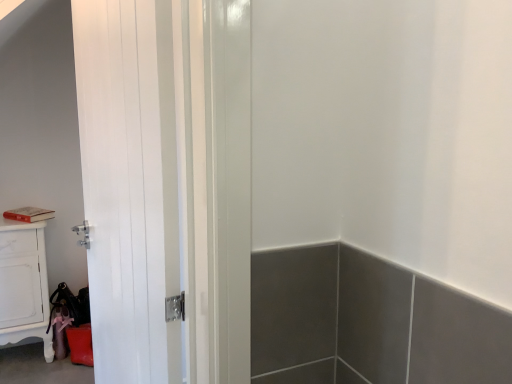
Measure the distance between point (209, 151) and camera.

Point (209, 151) and camera are 29.13 inches apart from each other.

This screenshot has width=512, height=384. Describe the element at coordinates (166, 183) in the screenshot. I see `white glossy door at center` at that location.

Where is `white glossy door at center`? This screenshot has width=512, height=384. white glossy door at center is located at coordinates (166, 183).

Where is `white glossy cabinet at lower left`? This screenshot has width=512, height=384. white glossy cabinet at lower left is located at coordinates (24, 284).

Measure the distance between point (11, 298) and camera.

Point (11, 298) is 7.76 feet from camera.

The width and height of the screenshot is (512, 384). Describe the element at coordinates (24, 284) in the screenshot. I see `white glossy cabinet at lower left` at that location.

In order to click on white glossy door at center in this screenshot , I will do `click(166, 183)`.

Is white glossy door at center at the left side of white glossy cabinet at lower left?

No, white glossy door at center is not to the left of white glossy cabinet at lower left.

Is the position of white glossy door at center more distant than that of white glossy cabinet at lower left?

No.

Which is closer, (106,164) or (21,328)?

Point (106,164) is positioned closer to the camera compared to point (21,328).

Looking at this image, from the image's perspective, relative to white glossy cabinet at lower left, is white glossy door at center above or below?

Clearly, from the image's perspective, white glossy door at center is above white glossy cabinet at lower left.

From a real-world perspective, is white glossy door at center on top of white glossy cabinet at lower left?

Correct, in the physical world, white glossy door at center is higher than white glossy cabinet at lower left.

Considering the sizes of objects white glossy door at center and white glossy cabinet at lower left in the image provided, who is thinner, white glossy door at center or white glossy cabinet at lower left?

Thinner between the two is white glossy door at center.

Between white glossy door at center and white glossy cabinet at lower left, which one has less height?

With less height is white glossy cabinet at lower left.

Who is bigger, white glossy door at center or white glossy cabinet at lower left?

white glossy door at center.

Consider the image. Is white glossy door at center inside or outside of white glossy cabinet at lower left?

white glossy door at center is spatially situated outside white glossy cabinet at lower left.

Would you say white glossy door at center is a long distance from white glossy cabinet at lower left?

That's right, there is a large distance between white glossy door at center and white glossy cabinet at lower left.

Could you tell me if white glossy door at center is turned towards white glossy cabinet at lower left?

No, white glossy door at center is not facing towards white glossy cabinet at lower left.

The width and height of the screenshot is (512, 384). I want to click on door on the right of white glossy cabinet at lower left, so click(166, 183).

Is white glossy cabinet at lower left at the left side of white glossy door at center?

Yes.

Which is behind, white glossy cabinet at lower left or white glossy door at center?

white glossy cabinet at lower left is further from the camera.

Is point (37, 317) less distant than point (138, 75)?

No, it is not.

From the image's perspective, is white glossy cabinet at lower left positioned above or below white glossy door at center?

Clearly, from the image's perspective, white glossy cabinet at lower left is below white glossy door at center.

Consider the image. From a real-world perspective, is white glossy cabinet at lower left positioned under white glossy door at center based on gravity?

Yes, from a real-world perspective, white glossy cabinet at lower left is beneath white glossy door at center.

Between white glossy cabinet at lower left and white glossy door at center, which one has larger width?

white glossy cabinet at lower left is wider.

Can you confirm if white glossy cabinet at lower left is shorter than white glossy door at center?

Indeed, white glossy cabinet at lower left has a lesser height compared to white glossy door at center.

Considering the sizes of objects white glossy cabinet at lower left and white glossy door at center in the image provided, who is bigger, white glossy cabinet at lower left or white glossy door at center?

With larger size is white glossy door at center.

Is white glossy cabinet at lower left spatially inside white glossy door at center, or outside of it?

white glossy cabinet at lower left is spatially situated outside white glossy door at center.

Would you say white glossy cabinet at lower left is a long distance from white glossy door at center?

That's right, there is a large distance between white glossy cabinet at lower left and white glossy door at center.

Is white glossy cabinet at lower left oriented away from white glossy door at center?

white glossy cabinet at lower left is not turned away from white glossy door at center.

The width and height of the screenshot is (512, 384). Identify the location of cabinetry located behind the white glossy door at center. (24, 284).

The height and width of the screenshot is (384, 512). What are the coordinates of `cabinetry on the left of white glossy door at center` in the screenshot? It's located at (24, 284).

Where is `cabinetry that appears behind the white glossy door at center`? This screenshot has height=384, width=512. cabinetry that appears behind the white glossy door at center is located at coordinates (24, 284).